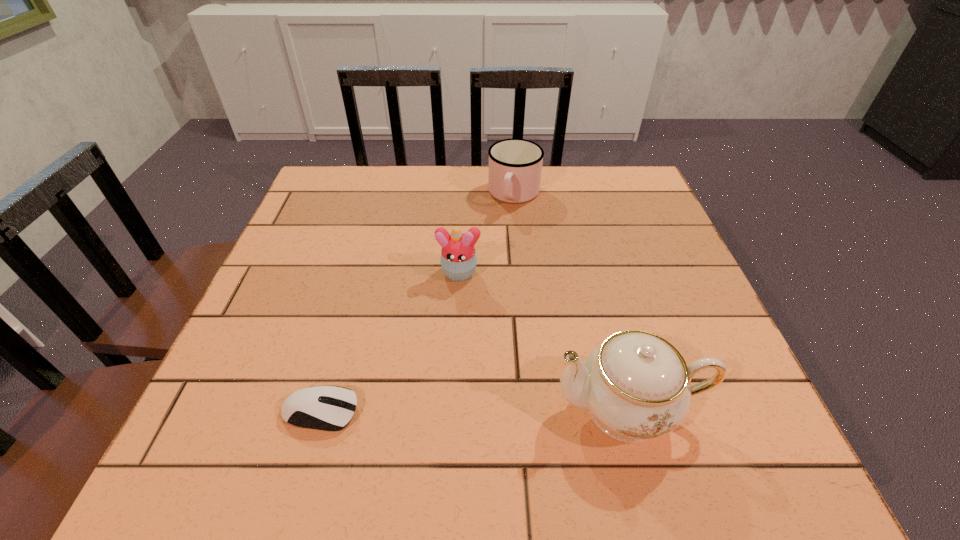
The image size is (960, 540). I want to click on vacant space situated 0.050m on the side of the mug with the handle, so click(505, 226).

Locate an element on the screen. Image resolution: width=960 pixels, height=540 pixels. vacant space positioned 0.190m on the side of the mug with the handle is located at coordinates (492, 262).

In order to click on free point located 0.240m on the side of the mug with the handle in this screenshot , I will do `click(488, 276)`.

You are a GUI agent. You are given a task and a screenshot of the screen. Output one action in this format:
    pyautogui.click(x=<x>, y=<y>)
    Task: Click on the free region located 0.300m on the face of the second farthest object
    The width and height of the screenshot is (960, 540).
    Given the screenshot: What is the action you would take?
    pyautogui.click(x=434, y=411)

Locate an element on the screen. The image size is (960, 540). vacant space located 0.110m on the face of the second farthest object is located at coordinates (449, 325).

Image resolution: width=960 pixels, height=540 pixels. Find the location of `vacant space situated 0.280m on the face of the second farthest object`. vacant space situated 0.280m on the face of the second farthest object is located at coordinates pos(436,401).

Find the location of a particular element. object that is positioned at the far edge is located at coordinates (515, 165).

Image resolution: width=960 pixels, height=540 pixels. I want to click on mouse that is positioned at the near edge, so click(x=317, y=407).

I want to click on chinaware that is positioned at the near edge, so click(x=636, y=386).

At what (x,y) coordinates should I click in order to perform the action: click on object present at the left edge. Please return your answer as a coordinate pair (x, y). This screenshot has width=960, height=540. Looking at the image, I should click on (317, 407).